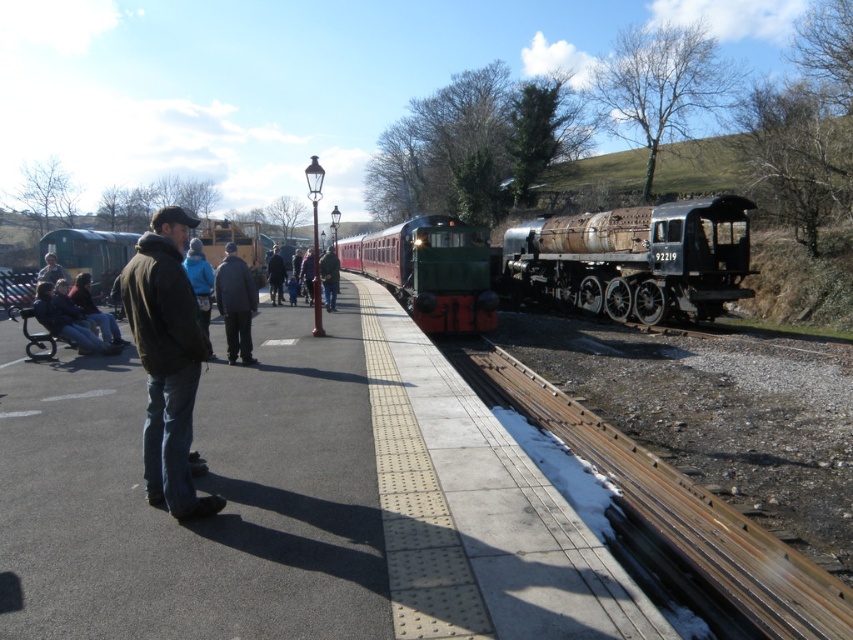
Who is more forward, [515,237] or [140,308]?

Point [140,308] is more forward.

Can you confirm if rusty metal train at right is smaller than dark brown leather jacket at left?

Actually, rusty metal train at right might be larger than dark brown leather jacket at left.

Is point (747, 237) positioned after point (160, 444)?

That is True.

Locate an element on the screen. The image size is (853, 640). rusty metal train at right is located at coordinates [636, 259].

Can you confirm if metal at right is shorter than dark brown leather jacket at center?

In fact, metal at right may be taller than dark brown leather jacket at center.

Which is behind, point (647, 570) or point (227, 316)?

Point (227, 316)

This screenshot has width=853, height=640. What are the coordinates of `metal at right` in the screenshot? It's located at (672, 518).

Which is behind, point (223, 230) or point (238, 304)?

Positioned behind is point (223, 230).

Can you confirm if green matte train at left is thinner than dark brown leather jacket at center?

In fact, green matte train at left might be wider than dark brown leather jacket at center.

Which is in front, point (55, 241) or point (230, 253)?

Positioned in front is point (230, 253).

Locate an element on the screen. This screenshot has width=853, height=640. green matte train at left is located at coordinates (91, 252).